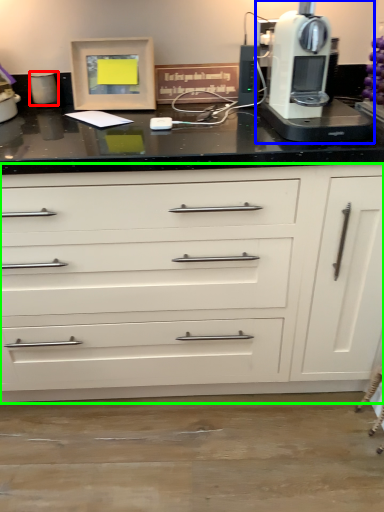
Question: Considering the real-world distances, which object is closest to kitchen appliance (highlighted by a red box)? home appliance (highlighted by a blue box) or chest of drawers (highlighted by a green box).

Choices:
 (A) home appliance
 (B) chest of drawers

Answer: (A)